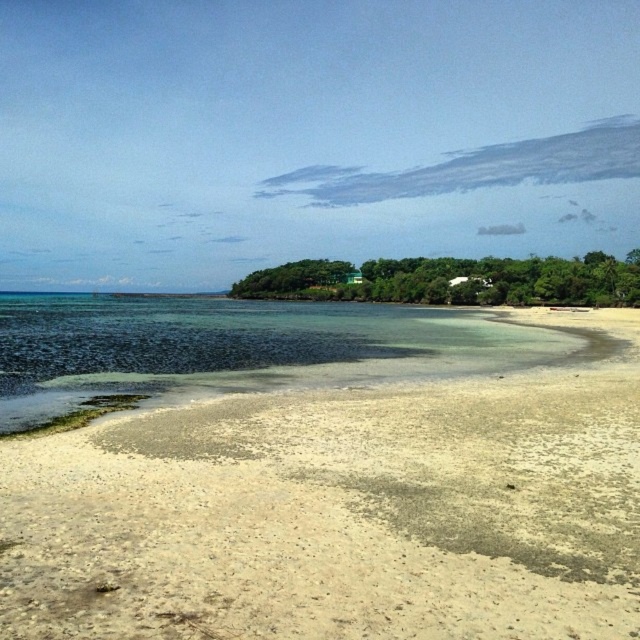
Question: Which object is the farthest from the green matte house at center?

Choices:
 (A) white sand beach at lower center
 (B) clear water at lower left

Answer: (A)

Question: Is white sand beach at lower center below clear water at lower left?

Choices:
 (A) yes
 (B) no

Answer: (A)

Question: Estimate the real-world distances between objects in this image. Which object is farther from the white sand beach at lower center?

Choices:
 (A) clear water at lower left
 (B) green matte house at center

Answer: (B)

Question: Is white sand beach at lower center behind green matte house at center?

Choices:
 (A) yes
 (B) no

Answer: (B)

Question: Which of the following is the farthest from the observer?

Choices:
 (A) (106, 396)
 (B) (244, 426)
 (C) (420, 291)

Answer: (C)

Question: Does white sand beach at lower center appear over green matte house at center?

Choices:
 (A) yes
 (B) no

Answer: (B)